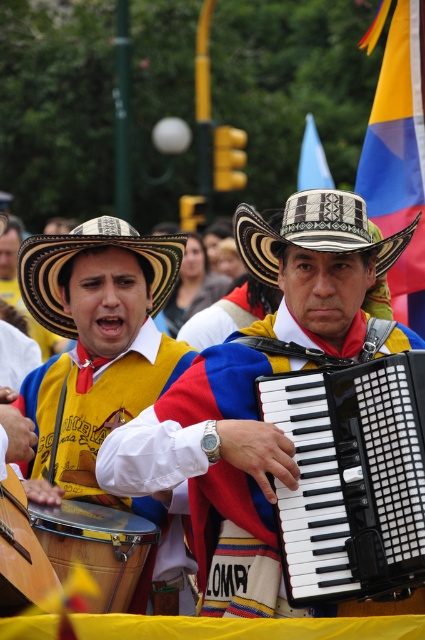
Question: Which object is farther from the camera taking this photo?

Choices:
 (A) black plastic accordion at center
 (B) matte black accordion at center
 (C) matte yellow vest at center
 (D) natural straw cowboy hat at center

Answer: (D)

Question: Which point is farther to the camera?

Choices:
 (A) (39, 240)
 (B) (342, 237)
 (C) (70, 467)
 (D) (138, 570)

Answer: (A)

Question: Based on their relative distances, which object is nearer to the white woven straw hat at center?

Choices:
 (A) black plastic accordion at center
 (B) matte black accordion at center
 (C) natural straw cowboy hat at center

Answer: (B)

Question: Does matte black accordion at center have a greater width compared to black plastic accordion at center?

Choices:
 (A) yes
 (B) no

Answer: (A)

Question: Can you confirm if yellow fabric flag at upper right is positioned to the left of natural straw cowboy hat at center?

Choices:
 (A) yes
 (B) no

Answer: (B)

Question: Does matte yellow vest at center appear on the right side of yellow fabric flag at upper right?

Choices:
 (A) yes
 (B) no

Answer: (B)